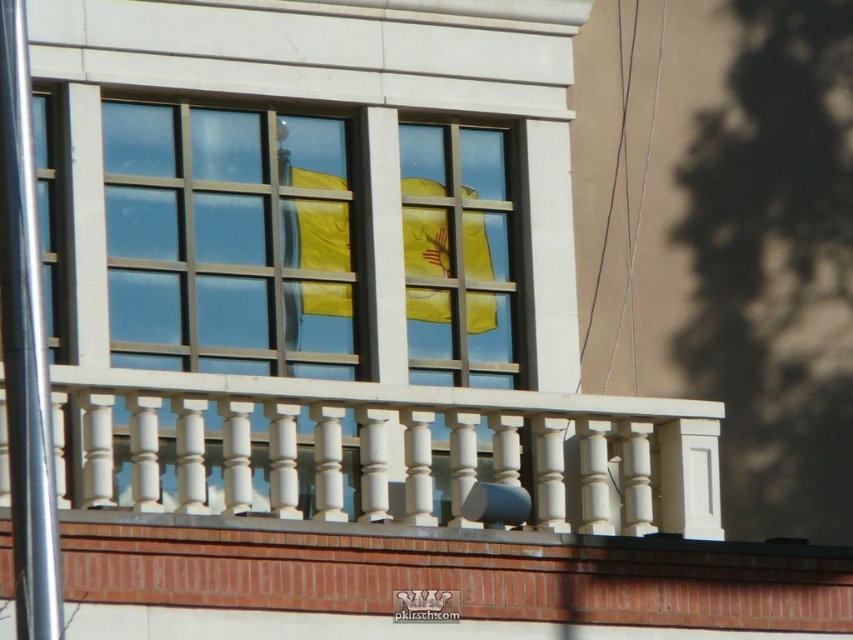
Question: Does white painted wood balcony at center have a larger size compared to polished silver pole at left?

Choices:
 (A) yes
 (B) no

Answer: (A)

Question: Which point is farther to the camera?

Choices:
 (A) tap(648, 486)
 (B) tap(477, 241)
 (C) tap(22, 324)

Answer: (B)

Question: Is white painted wood balcony at center wider than polished silver pole at left?

Choices:
 (A) yes
 (B) no

Answer: (A)

Question: Which of the following is the closest to the observer?

Choices:
 (A) polished silver pole at left
 (B) white painted wood balcony at center
 (C) yellow matte flag at center

Answer: (A)

Question: Among these objects, which one is farthest from the camera?

Choices:
 (A) polished silver pole at left
 (B) white painted wood balcony at center
 (C) yellow matte flag at center

Answer: (C)

Question: Can you confirm if polished silver pole at left is positioned below yellow matte flag at center?

Choices:
 (A) no
 (B) yes

Answer: (A)